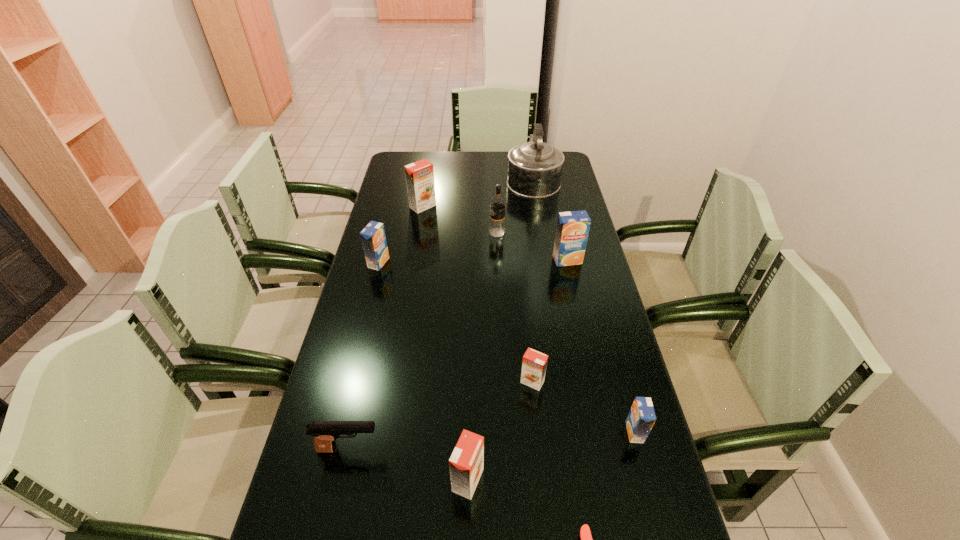
Locate an element on the screen. The width and height of the screenshot is (960, 540). free space between the fourth orange_juice from right to left and the biggest blue orange_juice is located at coordinates (517, 370).

In order to click on free space between the farthest object and the eighth farthest object in this screenshot , I will do `click(441, 314)`.

This screenshot has height=540, width=960. What are the coordinates of `free space between the fifth object from left to right and the farthest object` in the screenshot? It's located at (515, 206).

The image size is (960, 540). I want to click on free spot between the black pistol and the nearest blue orange_juice, so click(x=492, y=441).

Where is `unoccupied area between the fifth nearest object and the tallest object`? unoccupied area between the fifth nearest object and the tallest object is located at coordinates (533, 280).

Image resolution: width=960 pixels, height=540 pixels. In order to click on object that stands as the fourth closest to the third orange_juice from left to right in this screenshot , I will do `click(641, 418)`.

The image size is (960, 540). I want to click on object that stands as the fifth closest to the leftmost orange_juice, so point(534,364).

Where is `orange_juice that is the second closest to the farthest object`? orange_juice that is the second closest to the farthest object is located at coordinates (572, 230).

Locate which orange_juice ranks third in proximity to the second orange orange juice from left to right. Please provide its 2D coordinates. Your answer should be formatted as a tuple, i.e. [(x, y)], where the tuple contains the x and y coordinates of a point satisfying the conditions above.

[(373, 238)]

Where is `orange orange juice that can be found as the second closest to the second smallest blue orange_juice`? The width and height of the screenshot is (960, 540). orange orange juice that can be found as the second closest to the second smallest blue orange_juice is located at coordinates (534, 364).